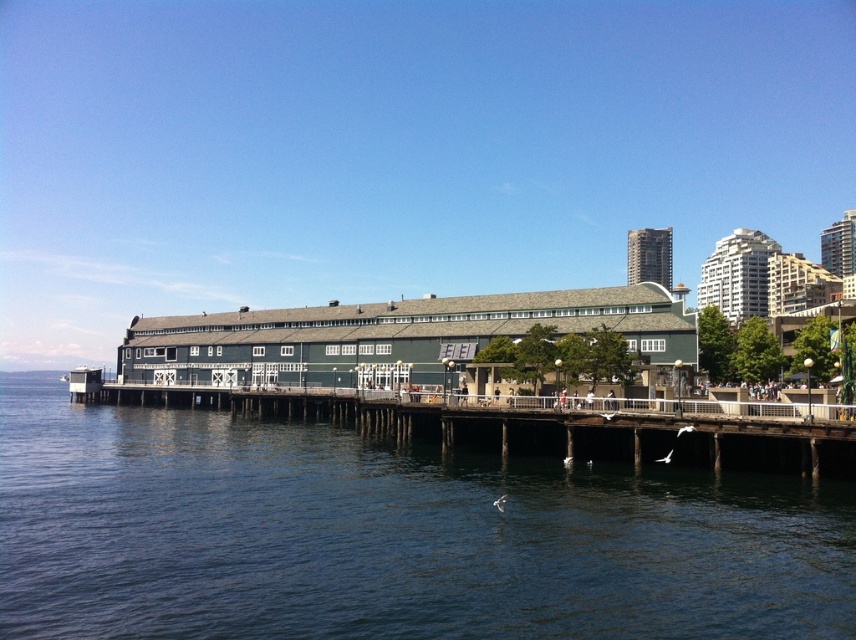
Question: Is dark blue water at lower center in front of brown wooden dock at center?

Choices:
 (A) yes
 (B) no

Answer: (A)

Question: Is dark blue water at lower center wider than brown wooden dock at center?

Choices:
 (A) no
 (B) yes

Answer: (B)

Question: Observing the image, what is the correct spatial positioning of dark blue water at lower center in reference to brown wooden dock at center?

Choices:
 (A) left
 (B) right

Answer: (A)

Question: Which of the following is the closest to the observer?

Choices:
 (A) dark blue water at lower center
 (B) brown wooden dock at center

Answer: (A)

Question: Which point is farther to the camera?

Choices:
 (A) (377, 598)
 (B) (428, 404)

Answer: (B)